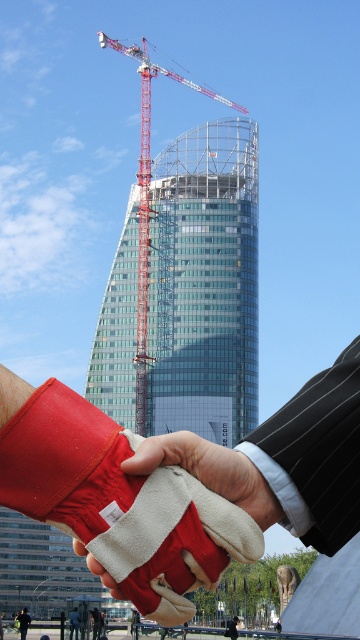
You are a construction worker standing at the center of the image. You see the red leather glove at center and the red metal crane at center. Which object is closer to the ground?

The red leather glove at center is below the red metal crane at center, so it is closer to the ground.

You are a construction worker who needs to choose between two red leather gloves in the image. The gloves are labeled as the red leather glove at center and the red leather glove at lower left. Which glove has a larger width?

The red leather glove at center has a larger width than the red leather glove at lower left.